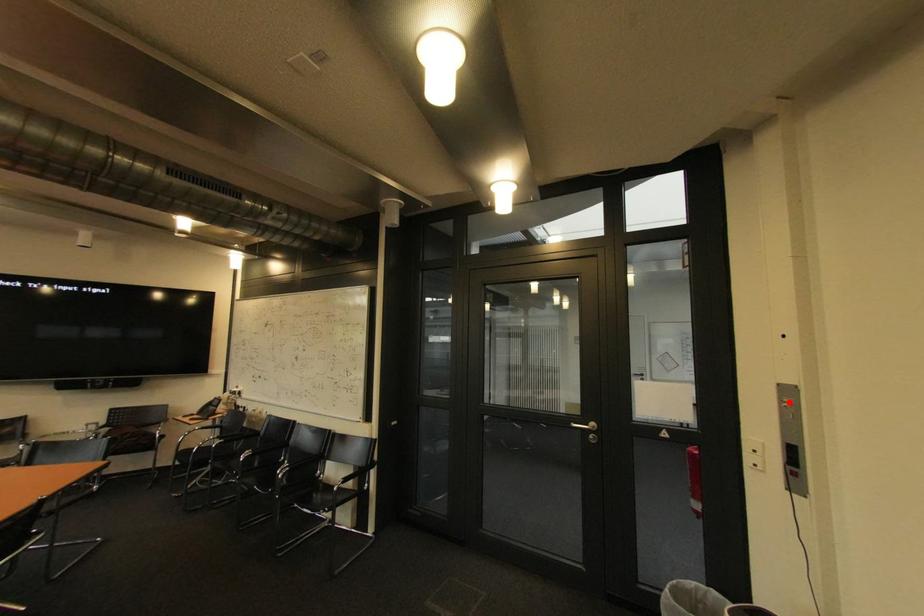
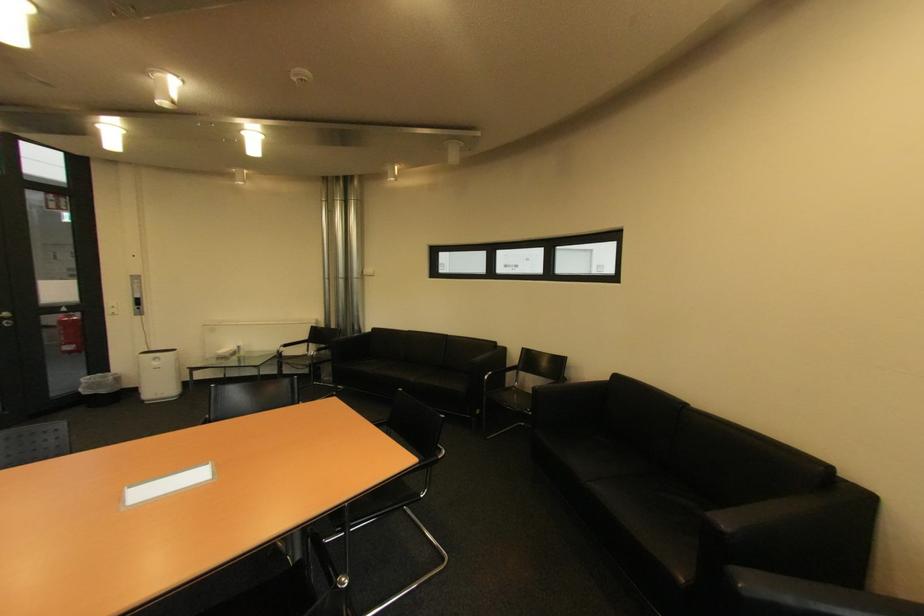
Locate, in the second image, the point that corresponds to the highlighted location in the first image.

(140, 283)